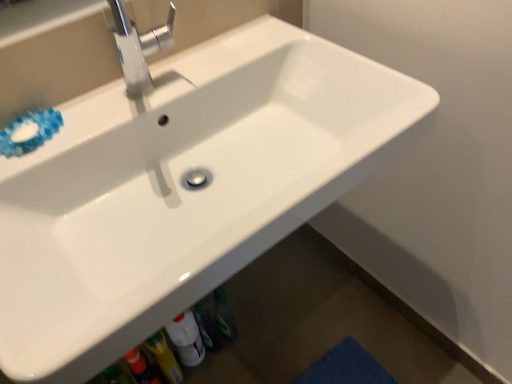
Question: In the image, is polished metallic faucet at upper center on the left side or the right side of white glossy bottle at lower center?

Choices:
 (A) left
 (B) right

Answer: (A)

Question: From the image's perspective, is polished metallic faucet at upper center above or below white glossy bottle at lower center?

Choices:
 (A) above
 (B) below

Answer: (A)

Question: Considering the positions of polished metallic faucet at upper center and white glossy bottle at lower center in the image, is polished metallic faucet at upper center wider or thinner than white glossy bottle at lower center?

Choices:
 (A) thin
 (B) wide

Answer: (B)

Question: From the image's perspective, relative to polished metallic faucet at upper center, is white glossy bottle at lower center above or below?

Choices:
 (A) below
 (B) above

Answer: (A)

Question: Would you say white glossy bottle at lower center is inside or outside polished metallic faucet at upper center?

Choices:
 (A) inside
 (B) outside

Answer: (B)

Question: Is white glossy bottle at lower center to the left or to the right of polished metallic faucet at upper center in the image?

Choices:
 (A) left
 (B) right

Answer: (B)

Question: In terms of width, does white glossy bottle at lower center look wider or thinner when compared to polished metallic faucet at upper center?

Choices:
 (A) thin
 (B) wide

Answer: (A)